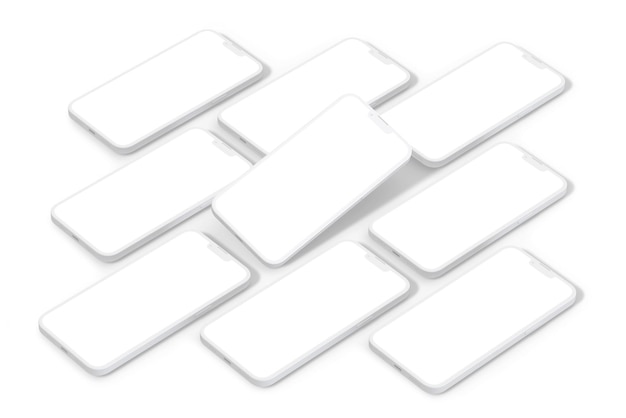
At what (x,y) coordinates should I click in order to perform the action: click on phones lying flat. Please return your answer as a coordinate pair (x, y). Looking at the image, I should click on (165, 277), (145, 165), (163, 104), (321, 88), (463, 108), (473, 197), (473, 333), (309, 293).